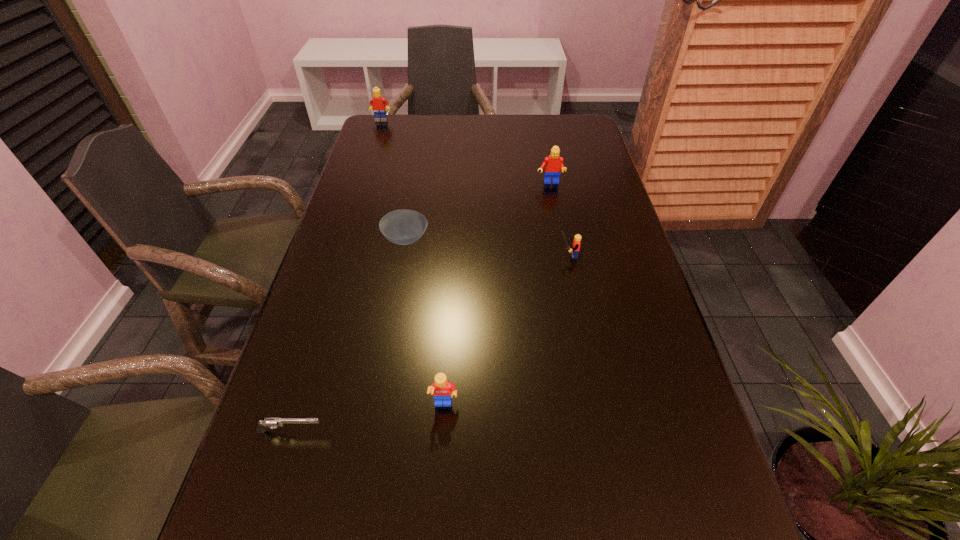
I want to click on the leftmost Lego, so click(x=377, y=103).

The image size is (960, 540). I want to click on the farthest Lego, so click(377, 103).

Find the location of a particular element. The image size is (960, 540). the second farthest Lego is located at coordinates (553, 163).

Locate an element on the screen. the third farthest Lego is located at coordinates (575, 249).

I want to click on the fourth object from left to right, so click(442, 390).

Where is `the second Lego from left to right`? The width and height of the screenshot is (960, 540). the second Lego from left to right is located at coordinates (442, 390).

Identify the location of the fourth object from right to left. (403, 227).

Find the location of a particular element. The height and width of the screenshot is (540, 960). pistol is located at coordinates (266, 423).

Locate an element on the screen. The image size is (960, 540). vacant space located on the front-facing side of the farthest Lego is located at coordinates (364, 174).

Find the location of a particular element. The height and width of the screenshot is (540, 960). free space located 0.330m on the front-facing side of the second farthest Lego is located at coordinates (565, 264).